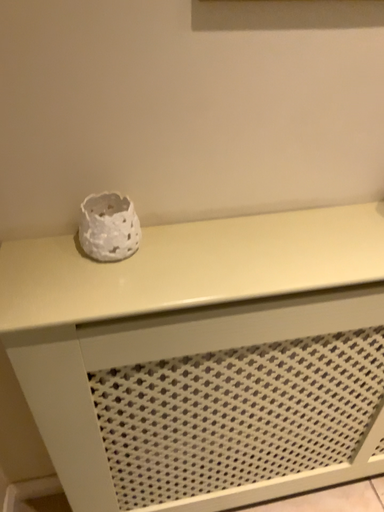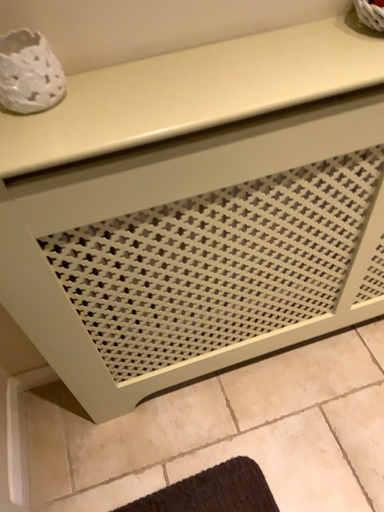
Question: Which way did the camera rotate in the video?

Choices:
 (A) rotated downward
 (B) rotated upward

Answer: (A)